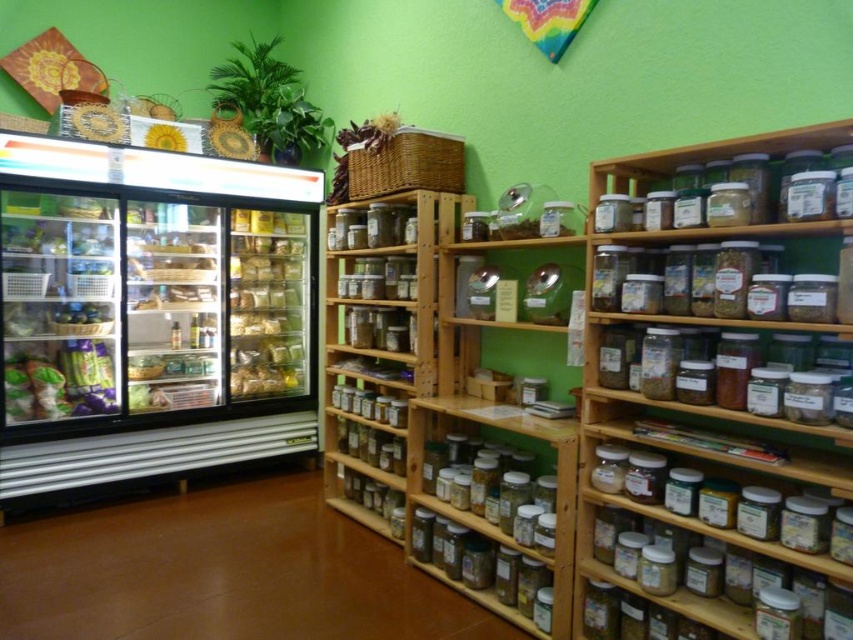
Question: Can you confirm if clear plastic jars at upper right is smaller than translucent plastic bag at center?

Choices:
 (A) yes
 (B) no

Answer: (B)

Question: Which object appears closest to the camera in this image?

Choices:
 (A) translucent plastic bag at center
 (B) clear glass refrigerator at left

Answer: (B)

Question: Which point is farther to the camera?

Choices:
 (A) (770, 618)
 (B) (230, 300)

Answer: (B)

Question: Is clear plastic jars at upper right positioned behind translucent plastic bag at center?

Choices:
 (A) no
 (B) yes

Answer: (A)

Question: Is clear plastic jars at upper right smaller than translucent plastic bag at center?

Choices:
 (A) yes
 (B) no

Answer: (B)

Question: Which of the following is the farthest from the observer?

Choices:
 (A) clear glass refrigerator at left
 (B) clear plastic jars at upper right
 (C) translucent plastic bag at center

Answer: (C)